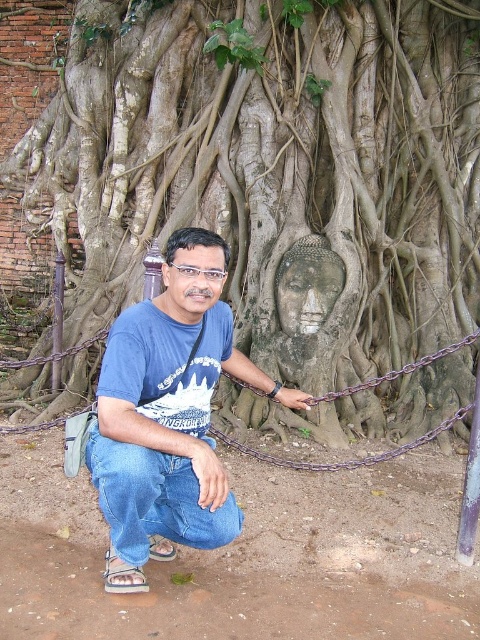
Question: Is gray stone buddha head at center positioned in front of rusty metal chain at center?

Choices:
 (A) yes
 (B) no

Answer: (B)

Question: Which point is farther to the camera?

Choices:
 (A) rusty metal chain at center
 (B) purple metallic chain at center

Answer: (A)

Question: Does gray stone buddha head at center appear over rusty metal chain at center?

Choices:
 (A) no
 (B) yes

Answer: (B)

Question: Considering the real-world distances, which object is closest to the purple metallic chain at center?

Choices:
 (A) gray stone buddha head at center
 (B) rusty metal chain at center

Answer: (B)

Question: Can you confirm if gray stone buddha head at center is positioned above purple metallic chain at center?

Choices:
 (A) no
 (B) yes

Answer: (B)

Question: Which is nearer to the blue cotton shirt at center?

Choices:
 (A) purple metallic chain at center
 (B) rusty metal chain at center
 (C) gray stone buddha head at center

Answer: (B)